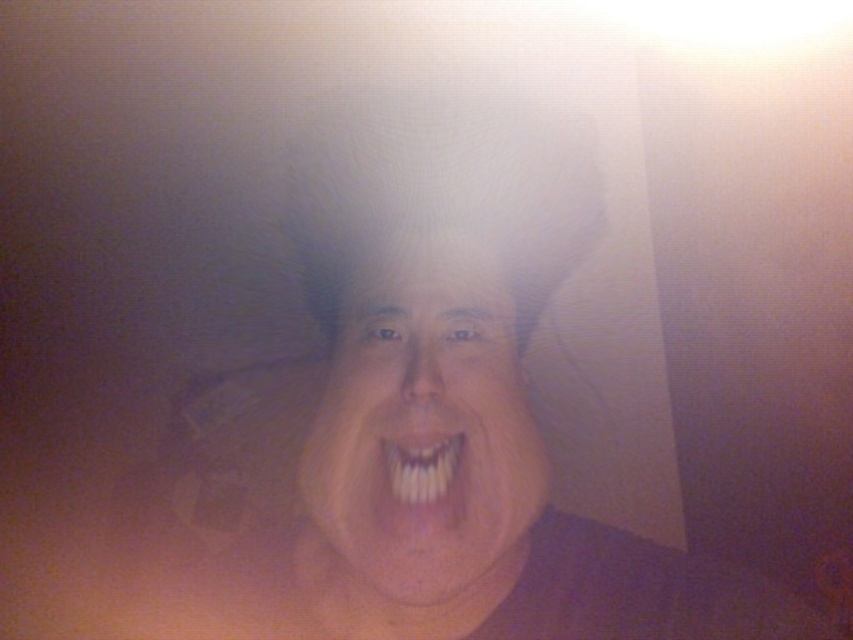
Which of these two, white glossy face at center or white glossy teeth at center, stands taller?

Standing taller between the two is white glossy face at center.

Does white glossy face at center appear over white glossy teeth at center?

Yes.

Between point (494, 333) and point (450, 470), which one is positioned in front?

Point (450, 470) is more forward.

Find the location of a particular element. white glossy face at center is located at coordinates (425, 426).